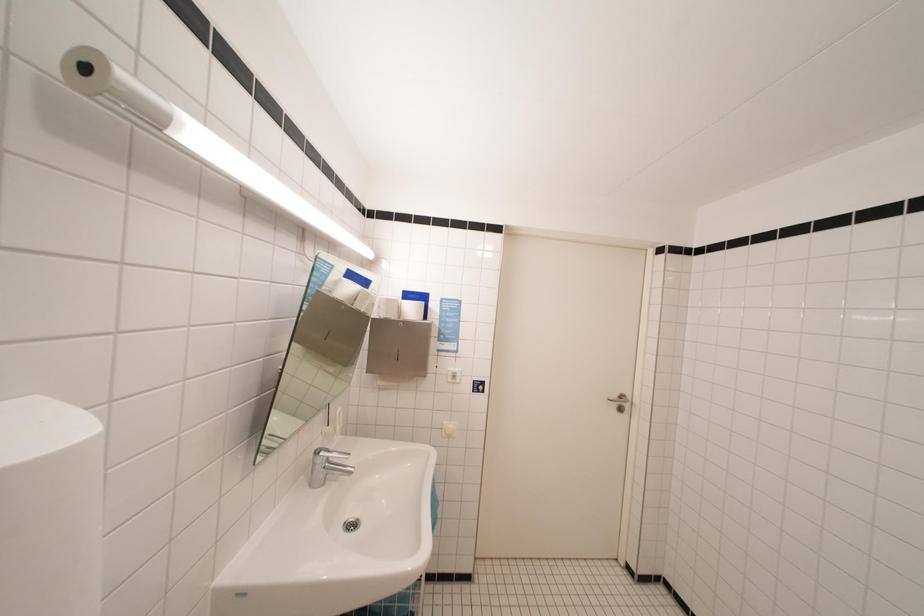
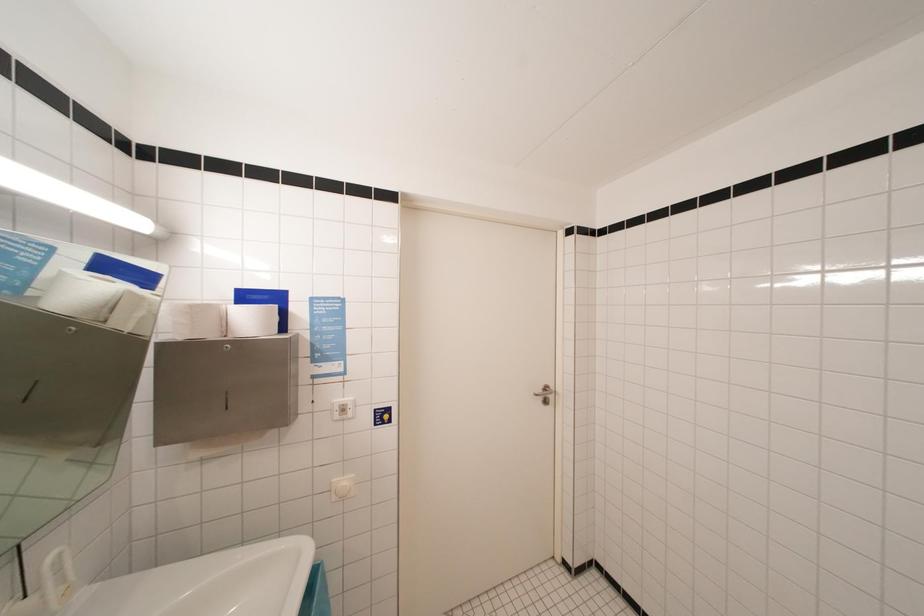
Question: The images are taken continuously from a first-person perspective. In which direction is your viewpoint rotating?

Choices:
 (A) Left
 (B) Right
 (C) Up
 (D) Down

Answer: (B)